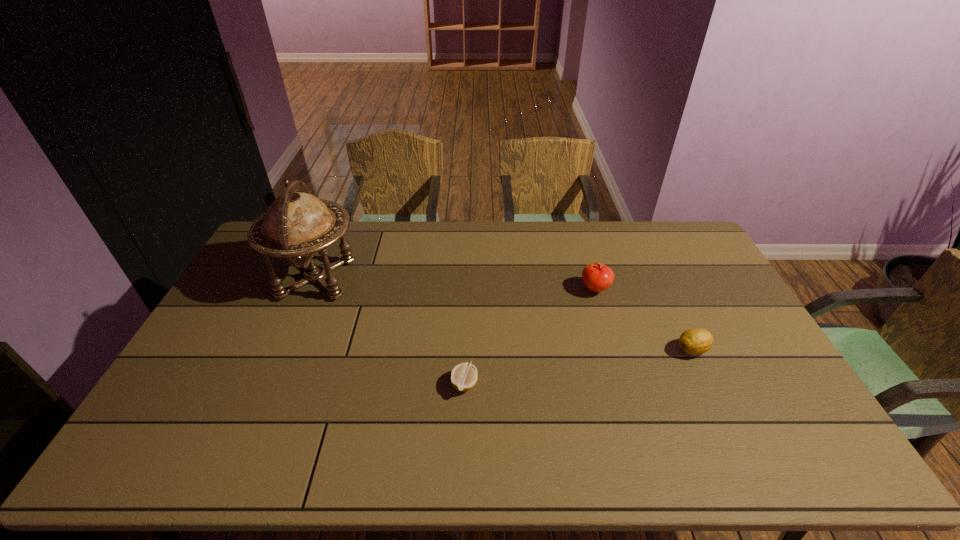
Find the location of a particular element. vacant space located 0.090m at the stem end of the farther lemon is located at coordinates (644, 349).

In order to click on vacant space positioned at the stem end of the farther lemon in this screenshot , I will do `click(579, 349)`.

This screenshot has height=540, width=960. In order to click on vacant space positioned 0.200m at the stem end of the farther lemon in this screenshot , I will do `click(607, 349)`.

In order to click on vacant space located 0.320m on the back of the left lemon in this screenshot , I will do `click(468, 292)`.

Locate an element on the screen. object that is at the far edge is located at coordinates (296, 225).

Find the location of a particular element. This screenshot has width=960, height=540. object that is at the left edge is located at coordinates (296, 225).

At what (x,y) coordinates should I click in order to perform the action: click on object located in the right edge section of the desktop. Please return your answer as a coordinate pair (x, y). The image size is (960, 540). Looking at the image, I should click on (695, 341).

Where is `object that is positioned at the far left corner`? This screenshot has width=960, height=540. object that is positioned at the far left corner is located at coordinates (296, 225).

This screenshot has height=540, width=960. Identify the location of free point at the far edge. (551, 237).

Identify the location of vacant space at the near edge. This screenshot has width=960, height=540. (653, 448).